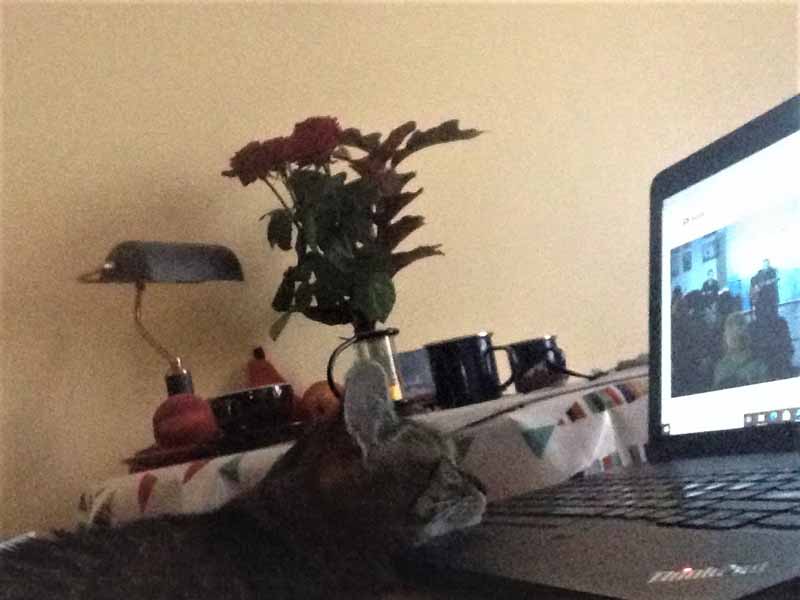
You are a GUI agent. You are given a task and a screenshot of the screen. Output one action in this format:
    pyautogui.click(x=<x>, y=<y>)
    Task: Click on the lampshade
    Image resolution: width=800 pixels, height=600 pixels.
    Given the screenshot: What is the action you would take?
    pyautogui.click(x=182, y=258)